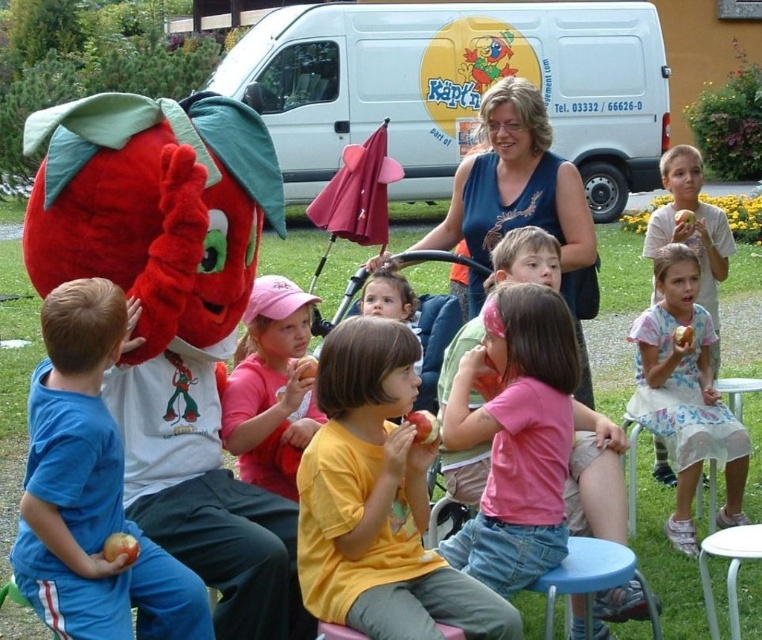
Who is lower down, blue fabric dress at center or floral cotton dress at lower right?

floral cotton dress at lower right is below.

Does blue fabric dress at center appear on the left side of floral cotton dress at lower right?

Yes, blue fabric dress at center is to the left of floral cotton dress at lower right.

What do you see at coordinates (520, 195) in the screenshot?
I see `blue fabric dress at center` at bounding box center [520, 195].

Identify the location of blue fabric dress at center. Image resolution: width=762 pixels, height=640 pixels. (520, 195).

Between pink fabric cap at center and red matte apple at center, which one appears on the right side from the viewer's perspective?

red matte apple at center is more to the right.

Between pink fabric cap at center and red matte apple at center, which one has less height?

With less height is red matte apple at center.

Is point (258, 378) closer to camera compared to point (415, 424)?

No, (258, 378) is further to viewer.

Locate an element on the screen. The width and height of the screenshot is (762, 640). pink fabric cap at center is located at coordinates (271, 387).

Is blue cotton shirt at center further to camera compared to smooth apple at lower right?

No, it is in front of smooth apple at lower right.

Can you confirm if blue cotton shirt at center is smaller than smooth apple at lower right?

Actually, blue cotton shirt at center might be larger than smooth apple at lower right.

Who is more forward, (40, 477) or (687, 220)?

Point (40, 477)

You are a GUI agent. You are given a task and a screenshot of the screen. Output one action in this format:
    pyautogui.click(x=<x>, y=<y>)
    Task: Click on the blue cotton shirt at center
    
    Given the screenshot: What is the action you would take?
    [x=90, y=490]